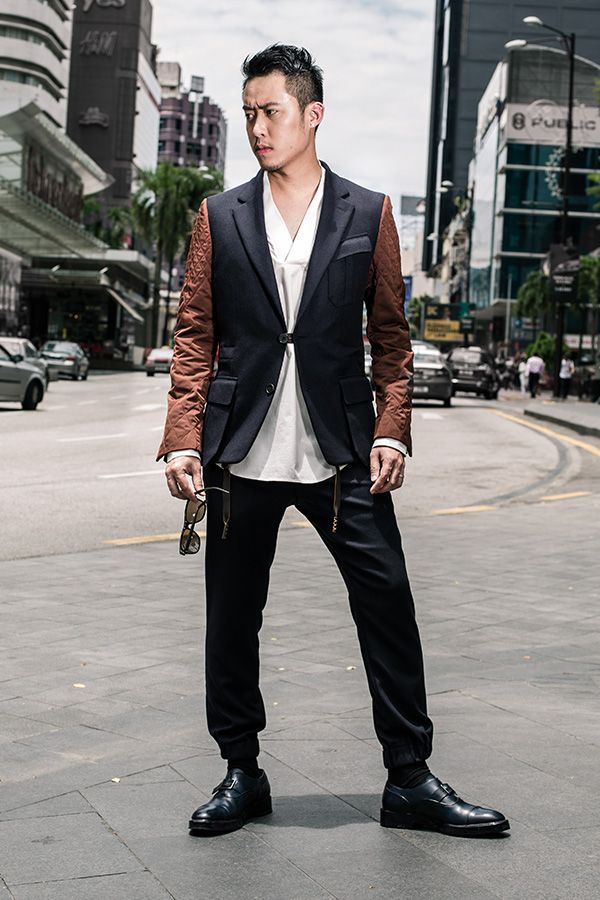
Where is `tiles`? This screenshot has width=600, height=900. tiles is located at coordinates (548, 796), (159, 796), (223, 847), (327, 832), (375, 869).